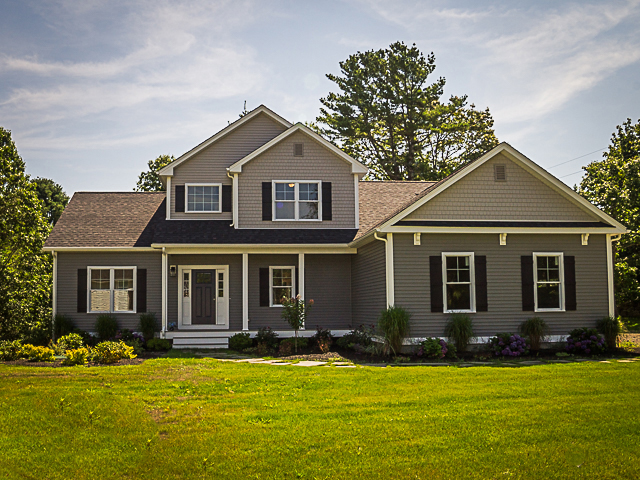
Locate an element on the screen. The width and height of the screenshot is (640, 480). windows is located at coordinates (196, 197), (102, 287), (121, 295), (284, 201), (303, 210), (283, 279), (457, 268), (547, 271).